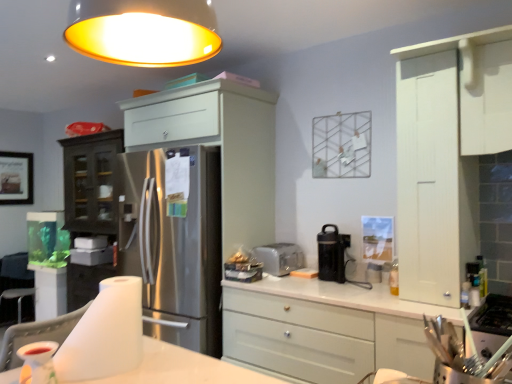
Question: Can you confirm if white fabric chair at lower left is taller than white matte cabinet at center, which is counted as the 2th cabinetry, starting from the right?

Choices:
 (A) no
 (B) yes

Answer: (A)

Question: From a real-world perspective, is white fabric chair at lower left located higher than white matte cabinet at center, which is counted as the 2th cabinetry, starting from the right?

Choices:
 (A) yes
 (B) no

Answer: (A)

Question: Is white fabric chair at lower left positioned with its back to white matte cabinet at center, which is counted as the 2th cabinetry, starting from the right?

Choices:
 (A) no
 (B) yes

Answer: (A)

Question: Is white fabric chair at lower left outside white matte cabinet at center, arranged as the 2th cabinetry when viewed from the left?

Choices:
 (A) no
 (B) yes

Answer: (B)

Question: From a real-world perspective, does white fabric chair at lower left sit lower than white matte cabinet at center, which is counted as the 2th cabinetry, starting from the right?

Choices:
 (A) no
 (B) yes

Answer: (A)

Question: In terms of height, does silver metallic toaster at center look taller or shorter compared to white matte cabinet at upper right, marked as the first cabinetry in a right-to-left arrangement?

Choices:
 (A) short
 (B) tall

Answer: (A)

Question: From the image's perspective, is silver metallic toaster at center positioned above or below white matte cabinet at upper right, marked as the first cabinetry in a right-to-left arrangement?

Choices:
 (A) above
 (B) below

Answer: (B)

Question: From a real-world perspective, is silver metallic toaster at center positioned above or below white matte cabinet at upper right, marked as the first cabinetry in a right-to-left arrangement?

Choices:
 (A) above
 (B) below

Answer: (B)

Question: Is silver metallic toaster at center to the left or to the right of white matte cabinet at upper right, marked as the first cabinetry in a right-to-left arrangement, in the image?

Choices:
 (A) right
 (B) left

Answer: (B)

Question: Considering the positions of point (245, 372) and point (441, 44), is point (245, 372) closer or farther from the camera than point (441, 44)?

Choices:
 (A) farther
 (B) closer

Answer: (B)

Question: From a real-world perspective, is white glossy table at lower center physically located above or below white matte cabinet at upper right, marked as the first cabinetry in a right-to-left arrangement?

Choices:
 (A) above
 (B) below

Answer: (B)

Question: In the image, is white glossy table at lower center positioned in front of or behind white matte cabinet at upper right, marked as the first cabinetry in a right-to-left arrangement?

Choices:
 (A) front
 (B) behind

Answer: (A)

Question: From the image's perspective, is white glossy table at lower center located above or below white matte cabinet at upper right, placed as the third cabinetry when sorted from left to right?

Choices:
 (A) above
 (B) below

Answer: (B)

Question: From the image's perspective, is wooden framed picture at left above or below white glossy table at lower center?

Choices:
 (A) below
 (B) above

Answer: (B)

Question: Is wooden framed picture at left wider or thinner than white glossy table at lower center?

Choices:
 (A) thin
 (B) wide

Answer: (A)